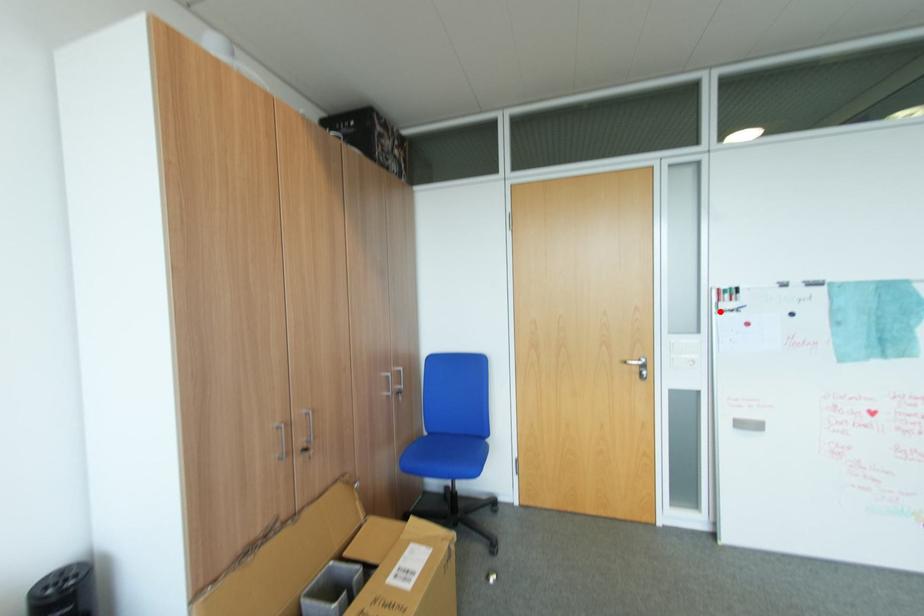
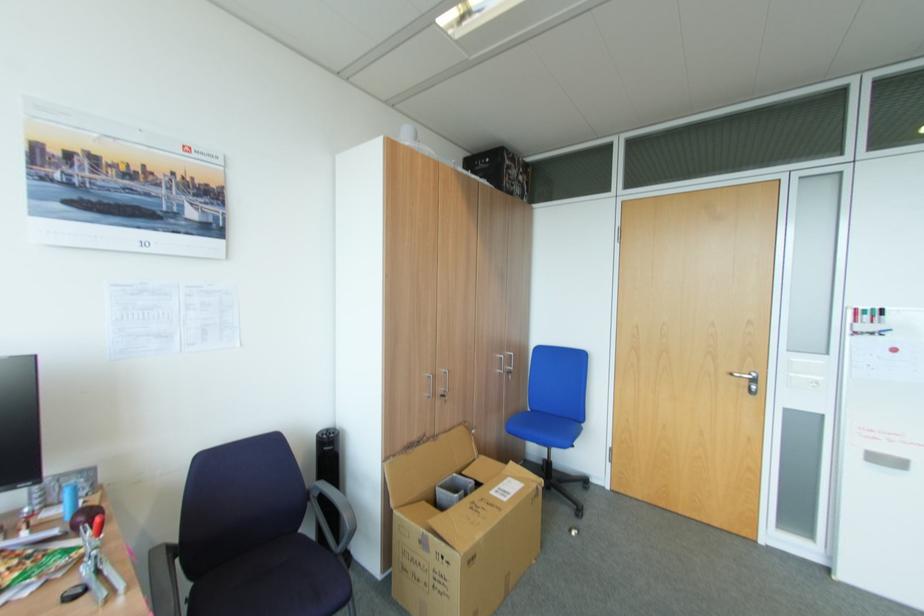
In the second image, find the point that corresponds to the highlighted location in the first image.

(856, 333)